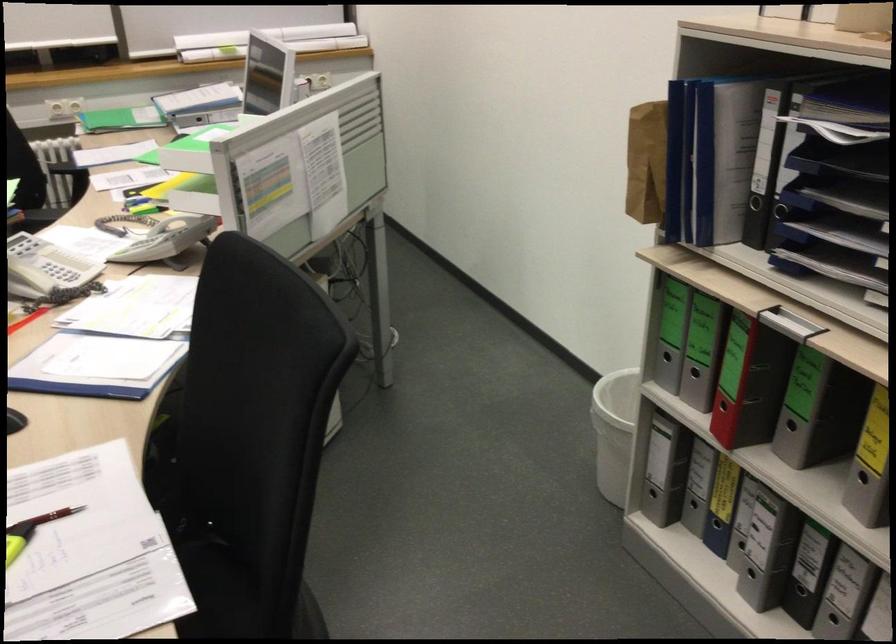
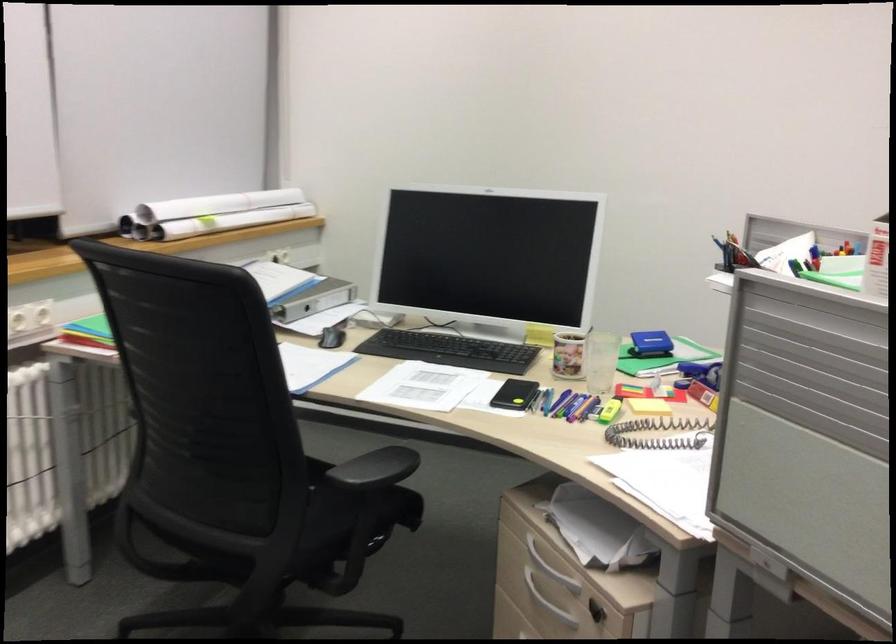
Find the pixel in the second image that matches (211,114) in the first image.

(314, 299)